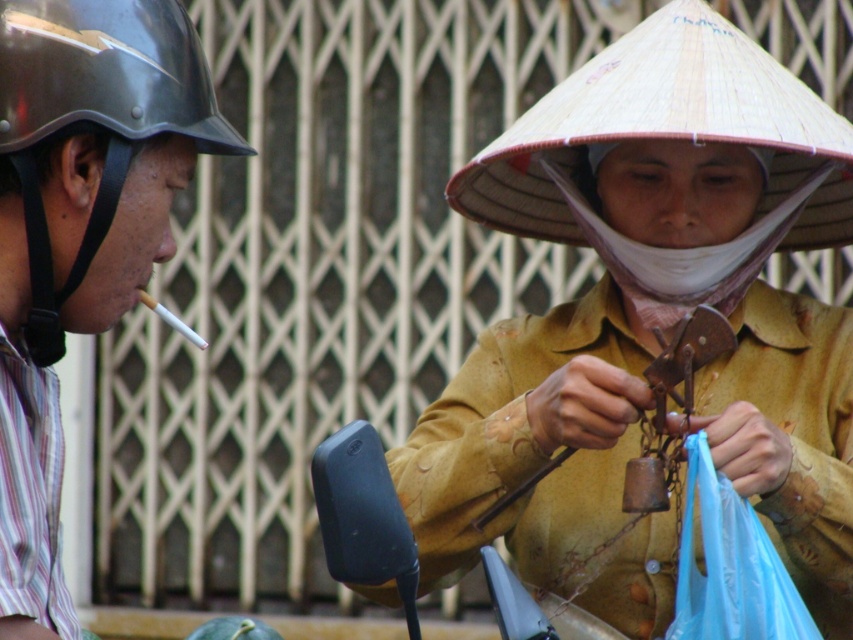
Does point (109, 28) come in front of point (682, 552)?

Yes.

Is shiny black helmet at left smaller than blue plastic bag at lower right?

No, shiny black helmet at left is not smaller than blue plastic bag at lower right.

This screenshot has height=640, width=853. What are the coordinates of `shiny black helmet at left` in the screenshot? It's located at (105, 74).

Does point (637, 401) come behind point (178, 99)?

Yes, point (637, 401) is behind point (178, 99).

The width and height of the screenshot is (853, 640). In order to click on matte yellow shirt at center in this screenshot , I will do `click(651, 324)`.

What do you see at coordinates (651, 324) in the screenshot? Image resolution: width=853 pixels, height=640 pixels. I see `matte yellow shirt at center` at bounding box center [651, 324].

Image resolution: width=853 pixels, height=640 pixels. Identify the location of matte yellow shirt at center. (651, 324).

Which is more to the left, matte yellow shirt at center or green matte watermelon at lower left?

green matte watermelon at lower left

Is point (466, 406) closer to viewer compared to point (242, 620)?

Yes, it is in front of point (242, 620).

The image size is (853, 640). What are the coordinates of `matte yellow shirt at center` in the screenshot? It's located at (651, 324).